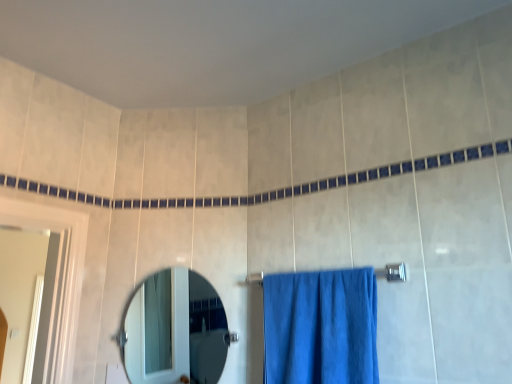
What do you see at coordinates (174, 332) in the screenshot?
I see `clear glass mirror at center` at bounding box center [174, 332].

What is the approximate width of blue fabric towel at center?

blue fabric towel at center is 7.46 inches wide.

You are a GUI agent. You are given a task and a screenshot of the screen. Output one action in this format:
    pyautogui.click(x=<x>, y=<y>)
    Task: Click on the silver metallic towel bar at center
    This screenshot has width=512, height=384.
    Given the screenshot: What is the action you would take?
    pyautogui.click(x=392, y=272)

At what (x,y) coordinates should I click in order to perform the action: click on clear glass mirror at center. Please return your answer as a coordinate pair (x, y). This screenshot has width=512, height=384. Looking at the image, I should click on (174, 332).

Is blue fabric towel at center facing away from silver metallic towel bar at center?

Yes.

Would you say silver metallic towel bar at center is part of blue fabric towel at center's contents?

Yes, blue fabric towel at center is surrounding silver metallic towel bar at center.

From a real-world perspective, between blue fabric towel at center and silver metallic towel bar at center, who is vertically higher?

From a 3D spatial view, silver metallic towel bar at center is above.

Who is shorter, blue fabric towel at center or silver metallic towel bar at center?

With less height is silver metallic towel bar at center.

What are the coordinates of `mirror on the left of silver metallic towel bar at center` in the screenshot? It's located at (174, 332).

Is point (204, 358) closer to viewer compared to point (257, 283)?

No, it is not.

Is clear glass mirror at center situated inside silver metallic towel bar at center or outside?

clear glass mirror at center is located beyond the bounds of silver metallic towel bar at center.

Based on the photo, from a real-world perspective, is clear glass mirror at center physically located above or below silver metallic towel bar at center?

clear glass mirror at center is situated lower than silver metallic towel bar at center in the real world.

From the image's perspective, which object appears higher, clear glass mirror at center or blue fabric towel at center?

blue fabric towel at center is shown above in the image.

Relative to blue fabric towel at center, is clear glass mirror at center in front or behind?

Visually, clear glass mirror at center is located behind blue fabric towel at center.

From a real-world perspective, which object stands above the other?

In real-world perspective, clear glass mirror at center is above.

How many degrees apart are the facing directions of clear glass mirror at center and blue fabric towel at center?

There is a 34.2-degree angle between the facing directions of clear glass mirror at center and blue fabric towel at center.

Considering the points (402, 276) and (187, 324), which point is in front, point (402, 276) or point (187, 324)?

The point (402, 276) is in front.

From a real-world perspective, is silver metallic towel bar at center physically below clear glass mirror at center?

No, from a real-world perspective, silver metallic towel bar at center is not below clear glass mirror at center.

This screenshot has height=384, width=512. I want to click on mirror on the left of the silver metallic towel bar at center, so click(x=174, y=332).

Between silver metallic towel bar at center and clear glass mirror at center, which one has larger size?

With larger size is clear glass mirror at center.

Is blue fabric towel at center not close to clear glass mirror at center?

Yes.

Is blue fabric towel at center at the left side of clear glass mirror at center?

No.

Based on their sizes in the image, would you say blue fabric towel at center is bigger or smaller than clear glass mirror at center?

Considering their sizes, blue fabric towel at center takes up more space than clear glass mirror at center.

Is silver metallic towel bar at center turned away from blue fabric towel at center?

Yes.

Does silver metallic towel bar at center touch blue fabric towel at center?

No, silver metallic towel bar at center is not in contact with blue fabric towel at center.

What are the coordinates of `towel bar located on the right of blue fabric towel at center` in the screenshot? It's located at (392, 272).

Image resolution: width=512 pixels, height=384 pixels. In order to click on curtain in front of the silver metallic towel bar at center in this screenshot , I will do `click(321, 327)`.

What are the coordinates of `mirror below the silver metallic towel bar at center (from the image's perspective)` in the screenshot? It's located at (174, 332).

Looking at the image, which one is located closer to silver metallic towel bar at center, clear glass mirror at center or blue fabric towel at center?

The object closer to silver metallic towel bar at center is blue fabric towel at center.

Looking at the image, which one is located further to silver metallic towel bar at center, blue fabric towel at center or clear glass mirror at center?

clear glass mirror at center is positioned further to the anchor silver metallic towel bar at center.

Considering their positions, is silver metallic towel bar at center positioned closer to blue fabric towel at center than clear glass mirror at center?

silver metallic towel bar at center is closer to blue fabric towel at center.

When comparing their distances from clear glass mirror at center, does silver metallic towel bar at center or blue fabric towel at center seem closer?

blue fabric towel at center lies closer to clear glass mirror at center than the other object.

Considering their positions, is blue fabric towel at center positioned further to clear glass mirror at center than silver metallic towel bar at center?

silver metallic towel bar at center lies further to clear glass mirror at center than the other object.

Which object lies nearer to the anchor point blue fabric towel at center, clear glass mirror at center or silver metallic towel bar at center?

Based on the image, silver metallic towel bar at center appears to be nearer to blue fabric towel at center.

Locate an element on the screen. The width and height of the screenshot is (512, 384). curtain located between clear glass mirror at center and silver metallic towel bar at center in the left-right direction is located at coordinates (321, 327).